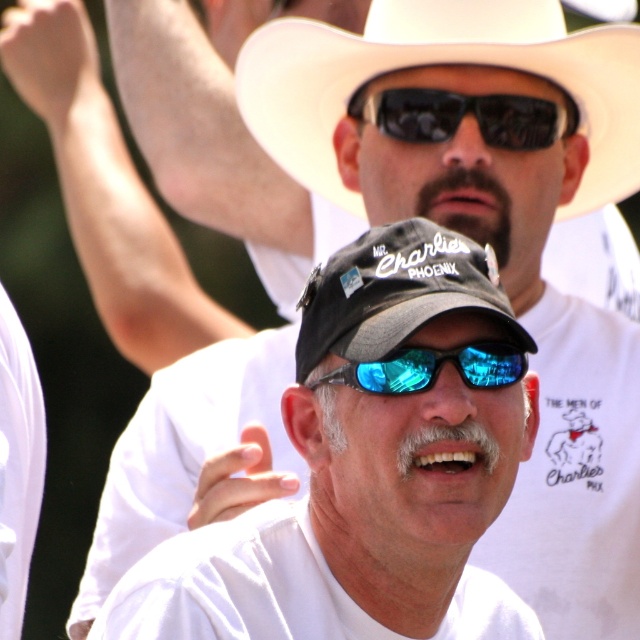
Is black matte cap at center positioned before white matte cowboy hat at upper center?

Yes, it is in front of white matte cowboy hat at upper center.

Does black matte cap at center have a lesser width compared to white matte cowboy hat at upper center?

Yes, black matte cap at center is thinner than white matte cowboy hat at upper center.

Between point (483, 262) and point (321, 108), which one is positioned behind?

The point (321, 108) is behind.

I want to click on black matte cap at center, so 406,413.

Which is above, white matte cowboy hat at upper center or black reflective sunglasses at center?

white matte cowboy hat at upper center

Based on the photo, is white matte cowboy hat at upper center shorter than black reflective sunglasses at center?

Incorrect, white matte cowboy hat at upper center's height does not fall short of black reflective sunglasses at center's.

Between point (307, 44) and point (372, 112), which one is positioned in front?

Point (372, 112)

Find the location of a particular element. The image size is (640, 640). white matte cowboy hat at upper center is located at coordinates (440, 64).

Which is behind, point (337, 384) or point (412, 108)?

Point (412, 108)

Is point (301, 378) positioned in front of point (541, 145)?

Yes.

The height and width of the screenshot is (640, 640). I want to click on black matte cap at center, so click(x=406, y=413).